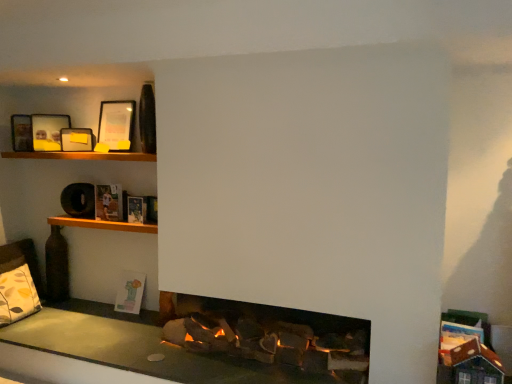
Question: Is wooden shelf at upper left, marked as the 1th shelf in a bottom-to-top arrangement, facing towards matte black picture frame at upper left, acting as the first picture frame starting from the left?

Choices:
 (A) no
 (B) yes

Answer: (A)

Question: Is wooden shelf at upper left, marked as the 1th shelf in a bottom-to-top arrangement, positioned with its back to matte black picture frame at upper left, which appears as the third picture frame when viewed from the right?

Choices:
 (A) no
 (B) yes

Answer: (A)

Question: Does wooden shelf at upper left, marked as the 1th shelf in a bottom-to-top arrangement, have a lesser width compared to matte black picture frame at upper left, acting as the first picture frame starting from the left?

Choices:
 (A) yes
 (B) no

Answer: (B)

Question: Does wooden shelf at upper left, acting as the second shelf starting from the top, have a larger size compared to matte black picture frame at upper left, acting as the first picture frame starting from the left?

Choices:
 (A) no
 (B) yes

Answer: (B)

Question: Are wooden shelf at upper left, acting as the second shelf starting from the top, and matte black picture frame at upper left, acting as the first picture frame starting from the left, located far from each other?

Choices:
 (A) yes
 (B) no

Answer: (B)

Question: Is hardcover book at upper left, the third book positioned from the bottom, inside the boundaries of hardcover book at upper left, which is counted as the 3th book, starting from the back, or outside?

Choices:
 (A) inside
 (B) outside

Answer: (B)

Question: Is point (112, 188) positioned closer to the camera than point (144, 206)?

Choices:
 (A) farther
 (B) closer

Answer: (A)

Question: Is hardcover book at upper left, acting as the second book starting from the back, to the left or to the right of hardcover book at upper left, which is counted as the 3th book, starting from the back, in the image?

Choices:
 (A) right
 (B) left

Answer: (B)

Question: From their relative heights in the image, would you say hardcover book at upper left, acting as the second book starting from the back, is taller or shorter than hardcover book at upper left, placed as the second book when sorted from bottom to top?

Choices:
 (A) tall
 (B) short

Answer: (A)

Question: From their relative heights in the image, would you say hardcover book at upper left, acting as the second book starting from the back, is taller or shorter than matte black picture frame at upper left, which appears as the third picture frame when viewed from the right?

Choices:
 (A) tall
 (B) short

Answer: (B)

Question: Does point (114, 195) appear closer or farther from the camera than point (58, 130)?

Choices:
 (A) closer
 (B) farther

Answer: (A)

Question: From a real-world perspective, is hardcover book at upper left, the first book viewed from the top, above or below matte black picture frame at upper left, acting as the first picture frame starting from the left?

Choices:
 (A) above
 (B) below

Answer: (B)

Question: From the image's perspective, relative to matte black picture frame at upper left, which appears as the third picture frame when viewed from the right, is hardcover book at upper left, acting as the second book starting from the back, above or below?

Choices:
 (A) below
 (B) above

Answer: (A)

Question: Do you think wooden shelf at upper left, the second shelf when ordered from bottom to top, is within pastel paper book at lower left, the 3th book when ordered from top to bottom, or outside of it?

Choices:
 (A) outside
 (B) inside

Answer: (A)

Question: Is wooden shelf at upper left, placed as the 1th shelf when sorted from top to bottom, taller or shorter than pastel paper book at lower left, which ranks as the 3th book in front-to-back order?

Choices:
 (A) tall
 (B) short

Answer: (B)